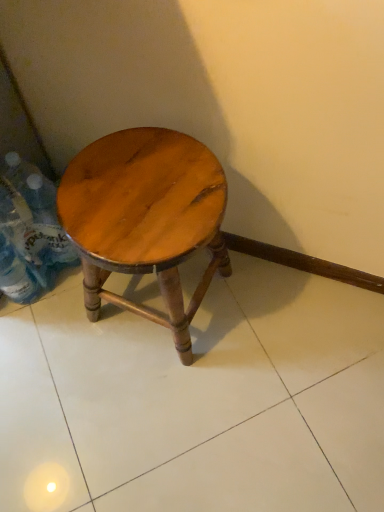
Identify the location of blank space situated above wooden stool at center (from a real-world perspective). The image size is (384, 512). (139, 193).